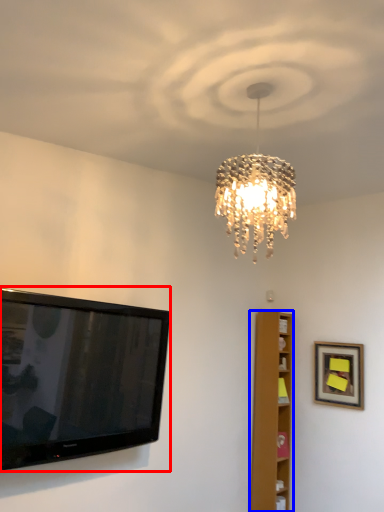
Question: Among these objects, which one is nearest to the camera, television (highlighted by a red box) or furniture (highlighted by a blue box)?

Choices:
 (A) television
 (B) furniture

Answer: (A)